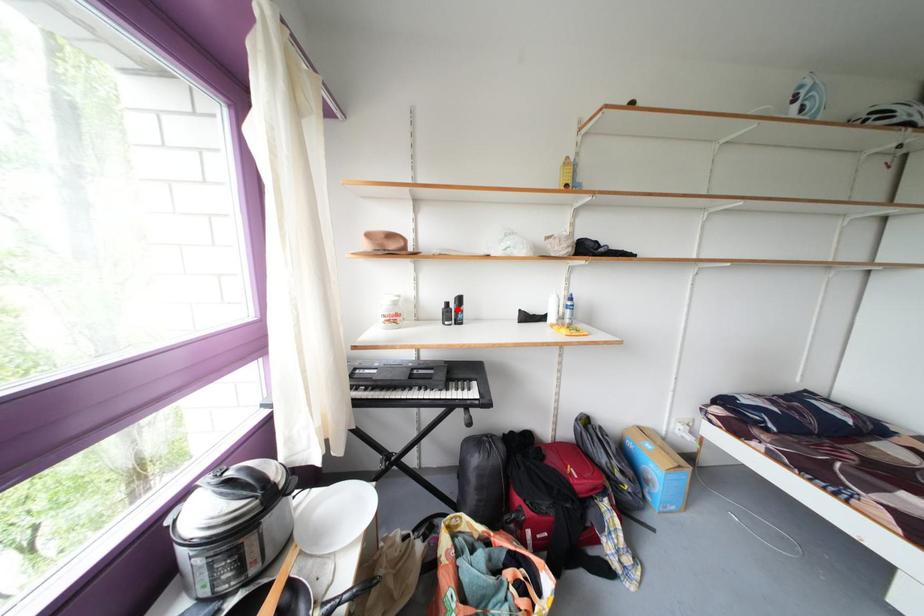
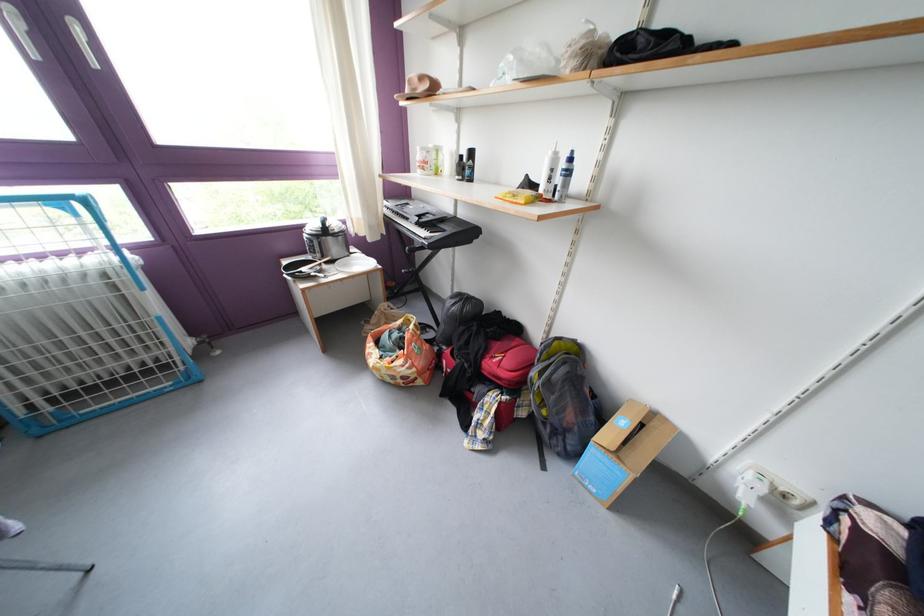
Find the pixel in the second image that matches the highlighted location in the first image.

(471, 161)